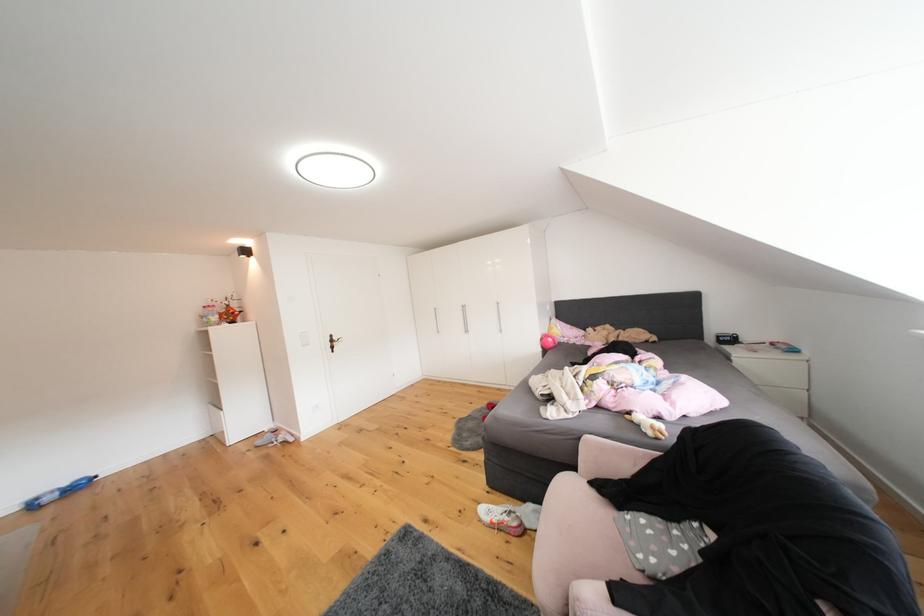
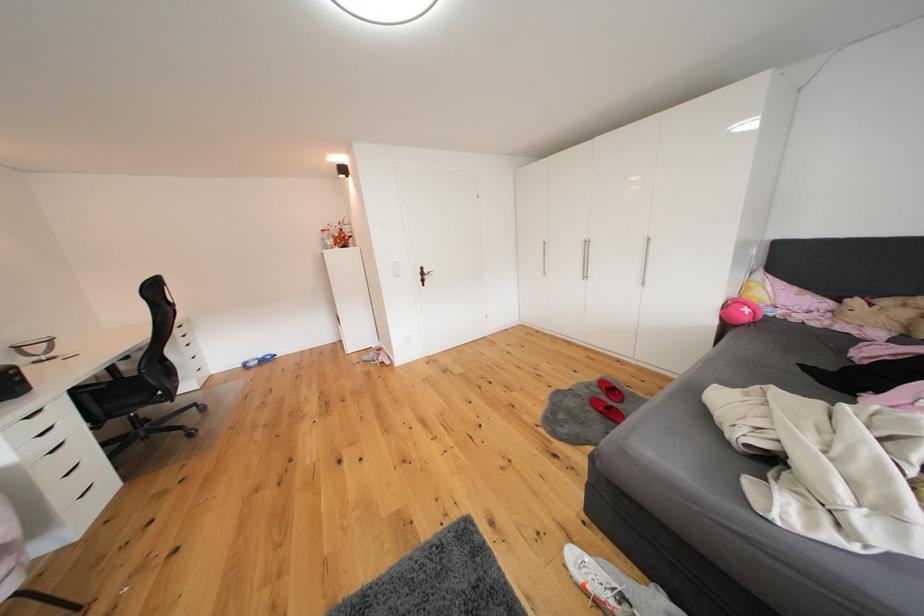
First-person continuous shooting, in which direction is the camera rotating?

The camera rotated toward left-down.